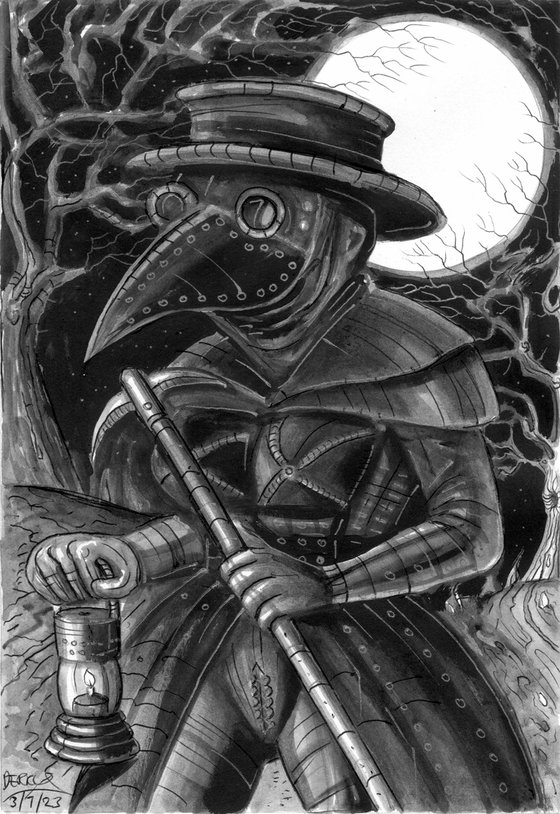
The image size is (560, 814). I want to click on lamp, so click(x=99, y=641).